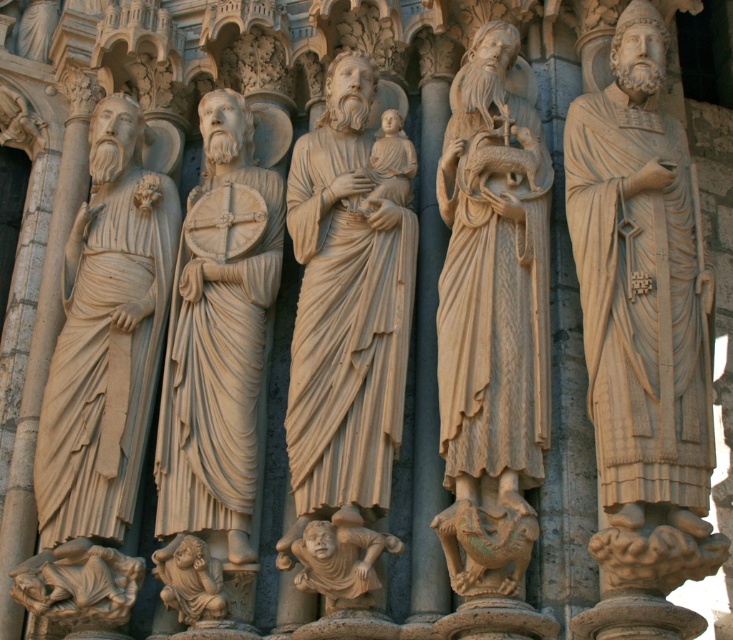
Question: Can you confirm if beige stone statue of man holding fish at center is smaller than beige stone cherub at center?

Choices:
 (A) yes
 (B) no

Answer: (B)

Question: Which is farther from the beige stone statue of man holding fish at center?

Choices:
 (A) beige stone statue at left
 (B) beige stone cherub at lower center
 (C) beige stone statue at center
 (D) beige stone cherub at center

Answer: (A)

Question: Observing the image, what is the correct spatial positioning of beige stone statue at center in reference to beige stone cherub at lower center?

Choices:
 (A) above
 (B) below

Answer: (A)

Question: Which of the following is the closest to the observer?

Choices:
 (A) (162, 576)
 (B) (449, 352)
 (C) (229, 474)
 (D) (342, 532)

Answer: (D)

Question: Which of the following is the closest to the observer?

Choices:
 (A) (500, 230)
 (B) (187, 592)
 (C) (54, 406)

Answer: (B)

Question: Can you confirm if beige stone statue of man holding fish at center is positioned to the right of beige stone statue at left?

Choices:
 (A) yes
 (B) no

Answer: (A)